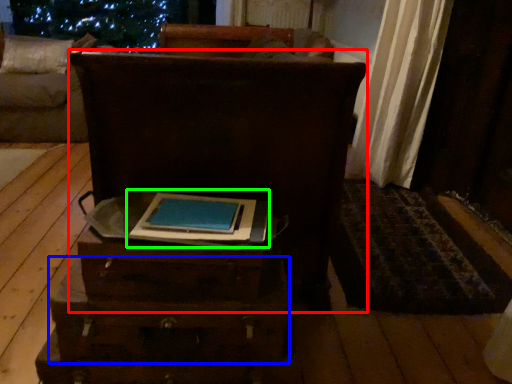
Question: Estimate the real-world distances between objects in this image. Which object is farther from furniture (highlighted by a red box), drawer (highlighted by a blue box) or book (highlighted by a green box)?

Choices:
 (A) drawer
 (B) book

Answer: (A)